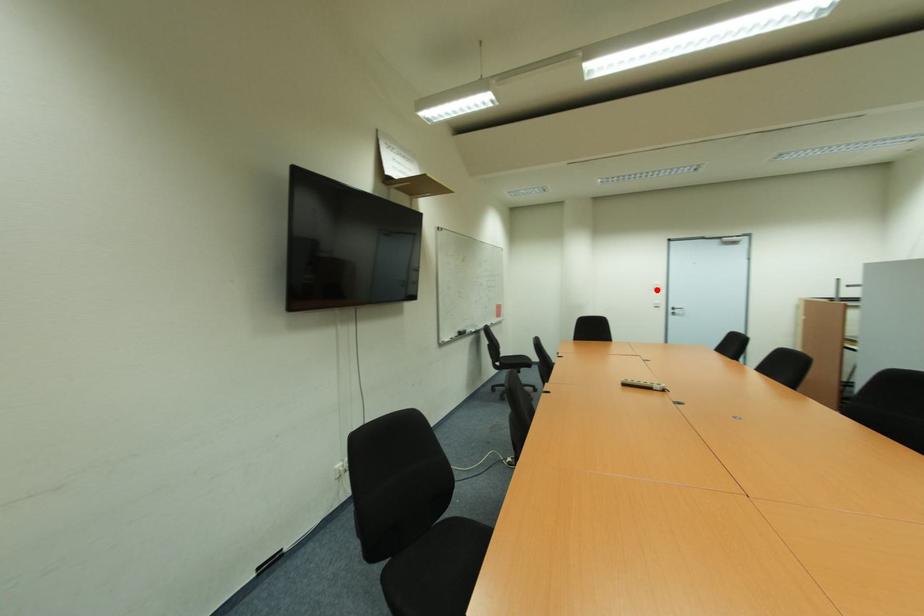
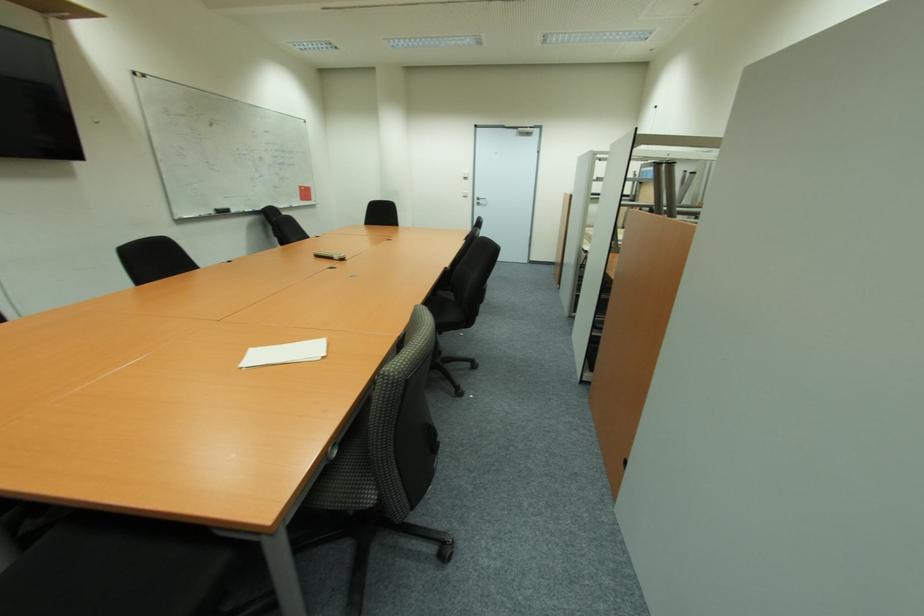
Question: I am providing you with two images of the same scene from different viewpoints. In image1, a red point is highlighted. Considering the same 3D point in image2, which of the following is correct?

Choices:
 (A) It is closer
 (B) It is farther

Answer: (A)